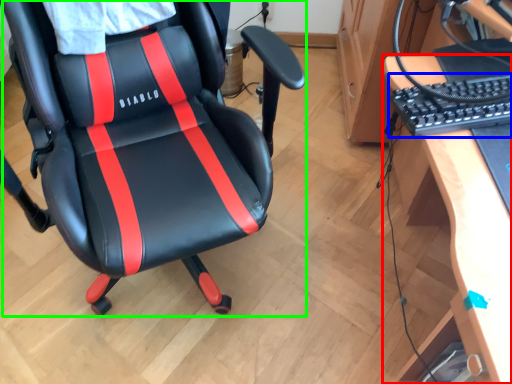
Question: Which object is the closest to the desk (highlighted by a red box)? Choose among these: computer keyboard (highlighted by a blue box) or chair (highlighted by a green box).

Choices:
 (A) computer keyboard
 (B) chair

Answer: (A)